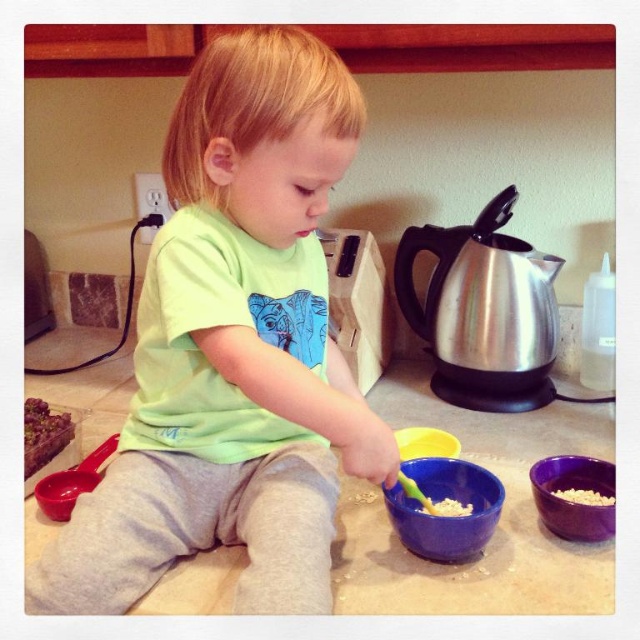
Looking at this image, you are a chef standing at the kitchen counter and need to place two ingredients at specific coordinates. The first ingredient must be placed at point (547, 497) and the second at (563, 497). Which point is closer to you?

Point (547, 497) is in front of point (563, 497), so the first point is closer to you.

The child is trying to pour the white crumbly food at lower right into the purple glossy bowl at lower right. Based on their sizes, will the bowl be able to hold all the food without spilling?

The purple glossy bowl at lower right has a larger width than the white crumbly food at lower right, so it should be able to hold all the food without spilling.